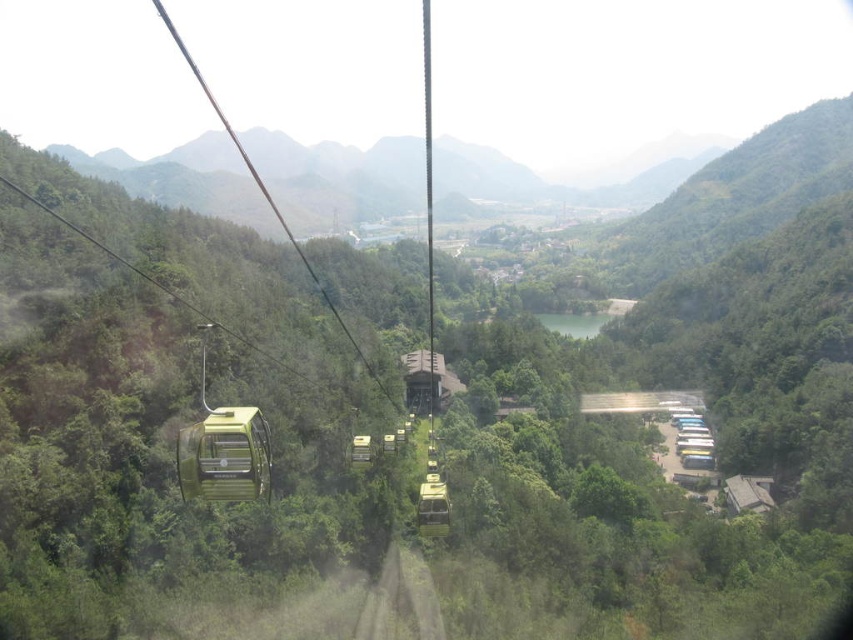
Is green matte/glossy cable car at center taller than metallic green cable car at left?

Correct, green matte/glossy cable car at center is much taller as metallic green cable car at left.

Does green matte/glossy cable car at center have a lesser height compared to metallic green cable car at left?

In fact, green matte/glossy cable car at center may be taller than metallic green cable car at left.

Which is behind, point (425, 177) or point (218, 412)?

The point (425, 177) is more distant.

The image size is (853, 640). Find the location of `green matte/glossy cable car at center`. green matte/glossy cable car at center is located at coordinates (428, 230).